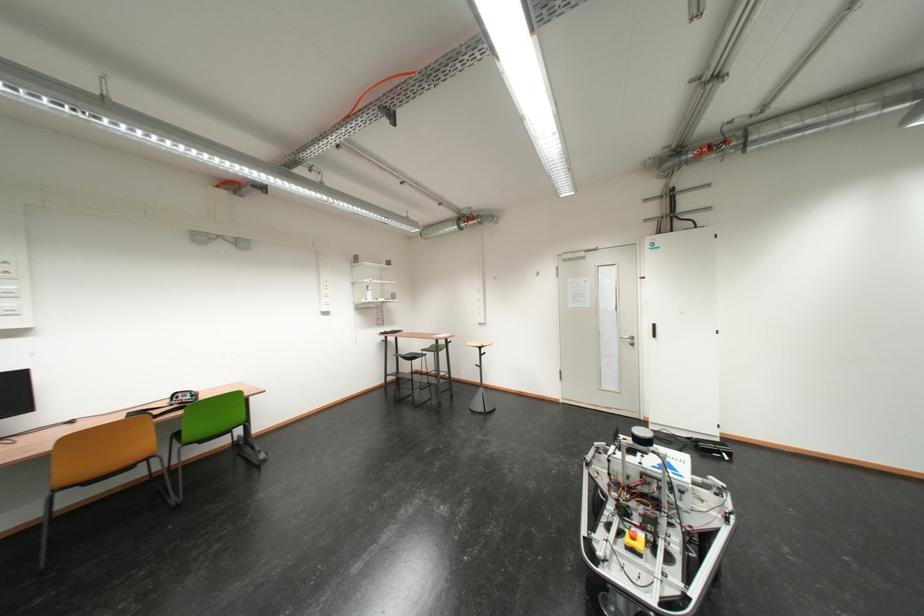
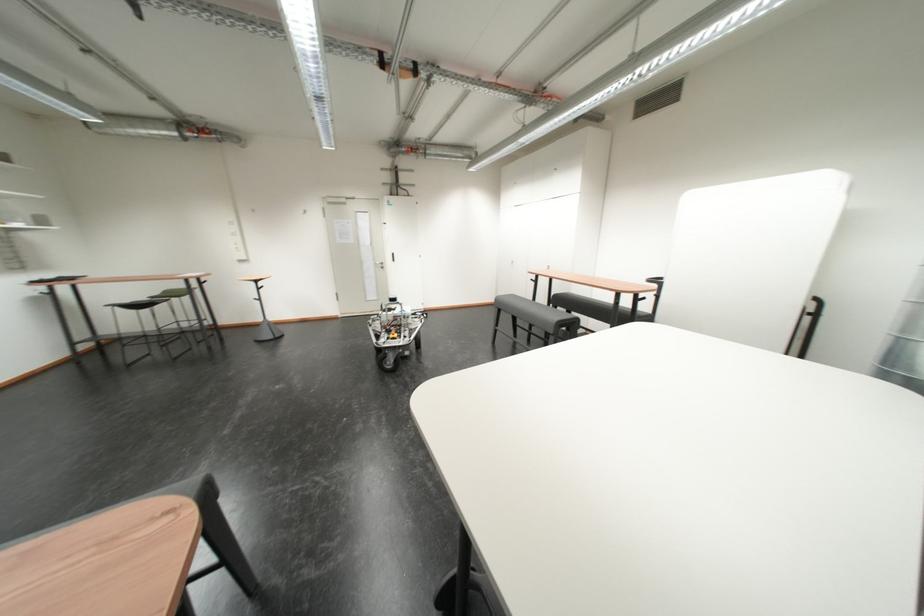
Where in the second image is the point corresponding to pixel 432 352 from the first image?

(160, 300)